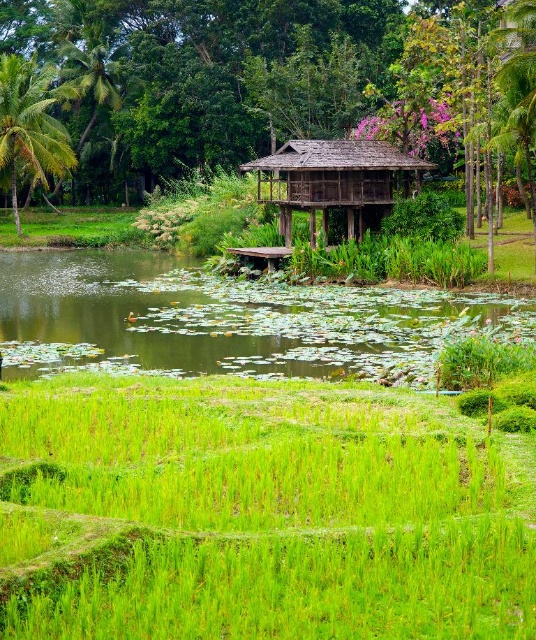
You are standing in the middle of the rice paddies looking towards the pond. There are two points marked in the scene, one at coordinate point (128, 385) and another at point (70, 161). Which point is closer to your current position?

Point (128, 385) is closer to the camera than point (70, 161), so the point at coordinate (128, 385) is closer to your current position in the rice paddies.

You are a gardener planning to plant new flowers in the green grassy rice field at center and green lily pads at center. Which area has more space available for planting?

The green lily pads at center have more space available for planting since they are wider than the green grassy rice field at center.

From the picture: You are a farmer who wants to plant a new crop that requires a height of at least 1.5 meters. Based on the scene, which area between the green grassy rice field at center and the green leafy palm tree at left would be suitable for planting?

The green leafy palm tree at left is taller than the green grassy rice field at center. Since the palm tree is taller, the area around it might be suitable for crops requiring at least 1.5 meters in height, but the rice field itself may not meet the height requirement.